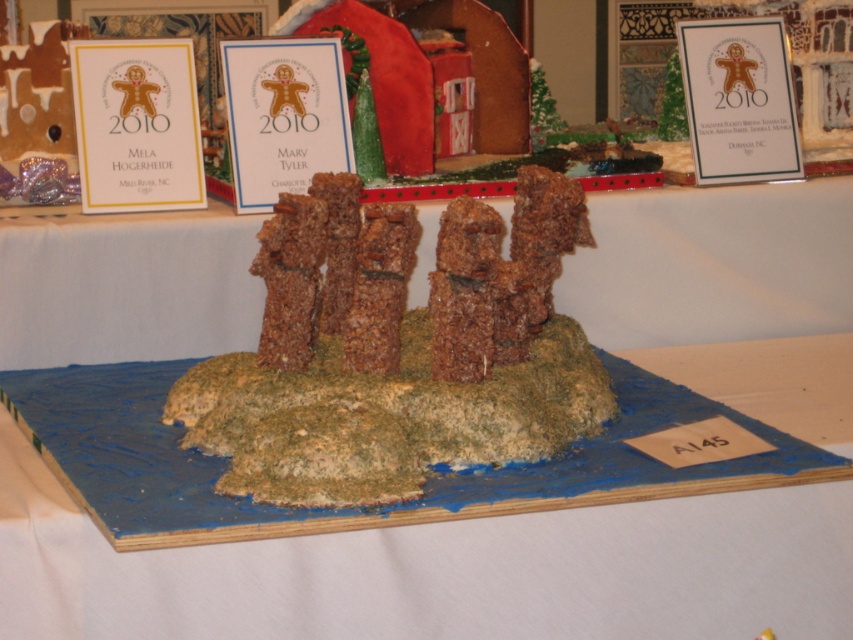
Can you confirm if blue paperboard at center is wider than brown crumbly cake at center?

Yes.

The height and width of the screenshot is (640, 853). Describe the element at coordinates (439, 572) in the screenshot. I see `blue paperboard at center` at that location.

Which is behind, point (149, 572) or point (372, 336)?

The point (372, 336) is more distant.

Where is `blue paperboard at center`? The height and width of the screenshot is (640, 853). blue paperboard at center is located at coordinates (439, 572).

Between brown crumbly cake at center and brown textured rice krispies treat at center, which one has less height?

With less height is brown textured rice krispies treat at center.

Does brown crumbly cake at center have a greater height compared to brown textured rice krispies treat at center?

Yes.

Locate an element on the screen. The height and width of the screenshot is (640, 853). brown crumbly cake at center is located at coordinates (389, 364).

This screenshot has width=853, height=640. In order to click on brown crumbly cake at center in this screenshot , I will do `click(389, 364)`.

Who is lower down, blue paperboard at center or brown textured rice krispies treat at center?

blue paperboard at center is below.

Is blue paperboard at center thinner than brown textured rice krispies treat at center?

Incorrect, blue paperboard at center's width is not less than brown textured rice krispies treat at center's.

Does point (230, 625) come farther from viewer compared to point (641, 289)?

No, (230, 625) is in front of (641, 289).

What are the coordinates of `blue paperboard at center` in the screenshot? It's located at (439, 572).